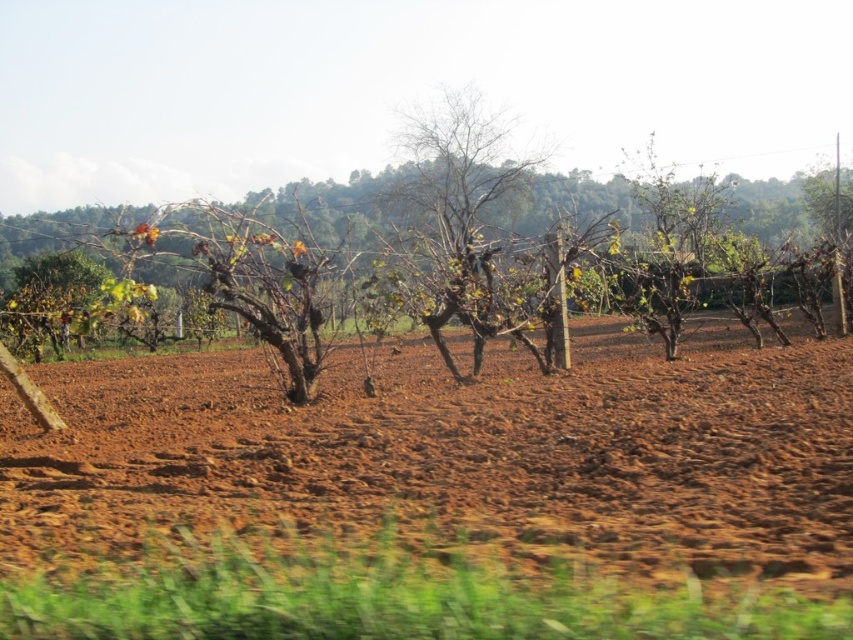
Question: Among these objects, which one is farthest from the camera?

Choices:
 (A) brown soil at center
 (B) brown bark tree at center

Answer: (B)

Question: Is brown soil at center above brown bark tree at center?

Choices:
 (A) no
 (B) yes

Answer: (A)

Question: Which of the following is the closest to the observer?

Choices:
 (A) brown soil at center
 (B) brown bark tree at center

Answer: (A)

Question: Does brown soil at center appear under brown bark tree at center?

Choices:
 (A) yes
 (B) no

Answer: (A)

Question: Does brown soil at center have a smaller size compared to brown bark tree at center?

Choices:
 (A) no
 (B) yes

Answer: (B)